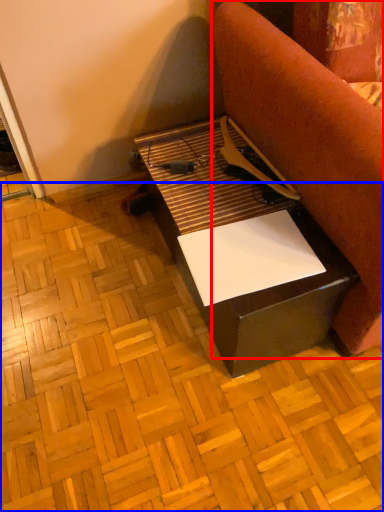
Question: Which of the following is the closest to the observer, furniture (highlighted by a red box) or plywood (highlighted by a blue box)?

Choices:
 (A) furniture
 (B) plywood

Answer: (A)